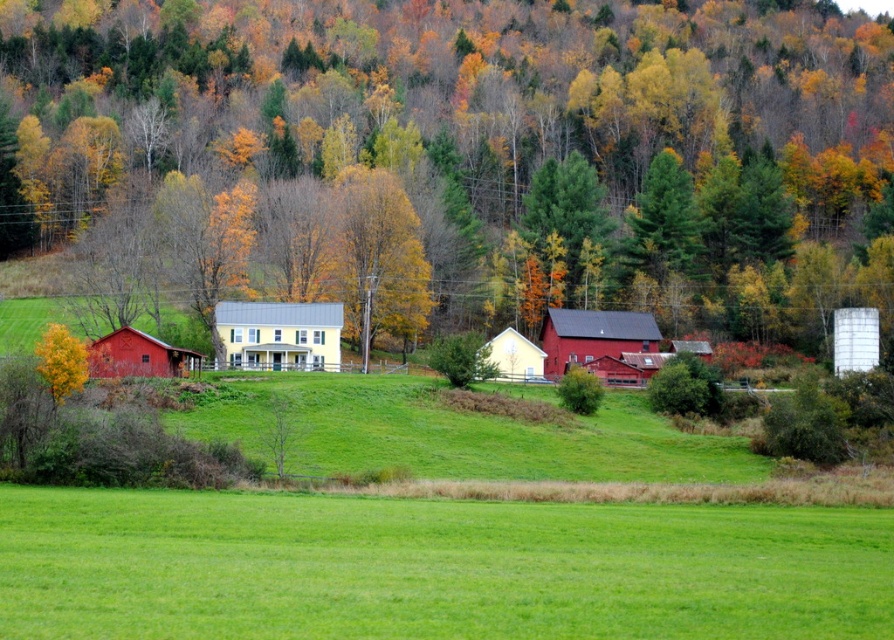
What do you see at coordinates (378, 257) in the screenshot? I see `yellow leafy tree at center` at bounding box center [378, 257].

Does yellow leafy tree at center appear over white matte barn at center?

Indeed, yellow leafy tree at center is positioned over white matte barn at center.

Locate an element on the screen. The height and width of the screenshot is (640, 894). yellow leafy tree at center is located at coordinates (378, 257).

Find the location of `yellow leafy tree at center`. yellow leafy tree at center is located at coordinates (378, 257).

In the scene shown: Does green matte tree at upper center have a smaller size compared to green grass field at lower center?

No, green matte tree at upper center is not smaller than green grass field at lower center.

Is point (267, 3) positioned before point (311, 588)?

No, it is behind (311, 588).

Identify the location of green matte tree at upper center. (457, 157).

Which of these two, green grass field at lower center or yellow matte house at center, stands taller?

Standing taller between the two is yellow matte house at center.

Between point (301, 604) and point (326, 305), which one is positioned in front?

Positioned in front is point (301, 604).

Identify the location of green grass field at lower center. Image resolution: width=894 pixels, height=640 pixels. (432, 566).